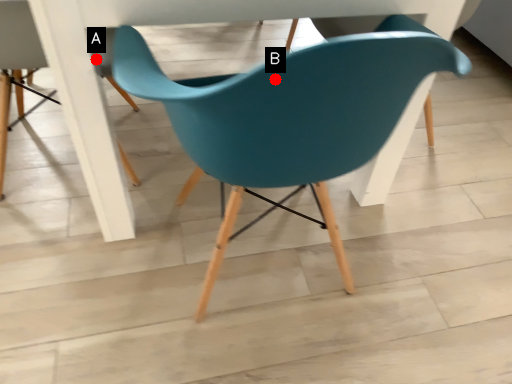
Question: Two points are circled on the image, labeled by A and B beside each circle. Which point is closer to the camera taking this photo?

Choices:
 (A) A is closer
 (B) B is closer

Answer: (B)